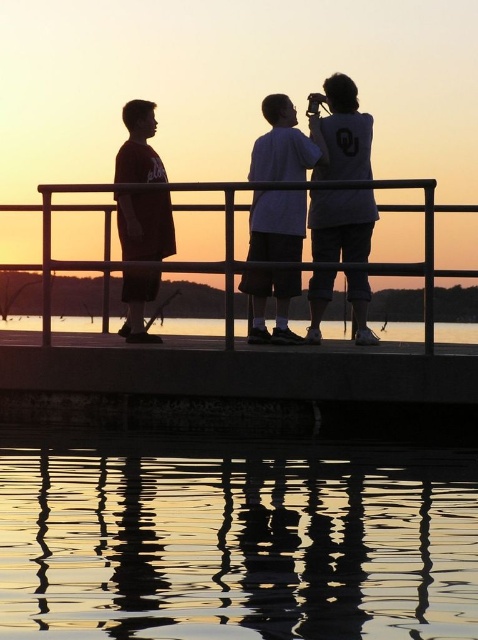
Is metallic silver rail at center closer to camera compared to transparent glass water at lower center?

Yes, metallic silver rail at center is closer to the viewer.

Can you confirm if metallic silver rail at center is smaller than transparent glass water at lower center?

No, metallic silver rail at center is not smaller than transparent glass water at lower center.

Does point (361, 268) come farther from viewer compared to point (463, 323)?

That is False.

Locate an element on the screen. The image size is (478, 640). metallic silver rail at center is located at coordinates (232, 241).

Looking at this image, is metallic silver rail at center positioned at the back of white matte shirt at center?

No, it is in front of white matte shirt at center.

Between metallic silver rail at center and white matte shirt at center, which one appears on the right side from the viewer's perspective?

white matte shirt at center

Image resolution: width=478 pixels, height=640 pixels. Identify the location of metallic silver rail at center. (232, 241).

I want to click on metallic silver rail at center, so click(x=232, y=241).

Who is shorter, white matte shirt at center or transparent glass water at lower center?

With less height is transparent glass water at lower center.

Is point (315, 116) farther from viewer compared to point (386, 330)?

No.

Locate an element on the screen. Image resolution: width=478 pixels, height=640 pixels. white matte shirt at center is located at coordinates (284, 144).